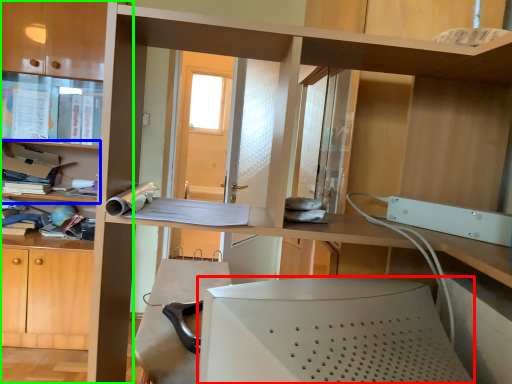
Question: Considering the real-world distances, which object is closest to desktop computer (highlighted by a red box)? shelf (highlighted by a blue box) or bookcase (highlighted by a green box).

Choices:
 (A) shelf
 (B) bookcase

Answer: (B)